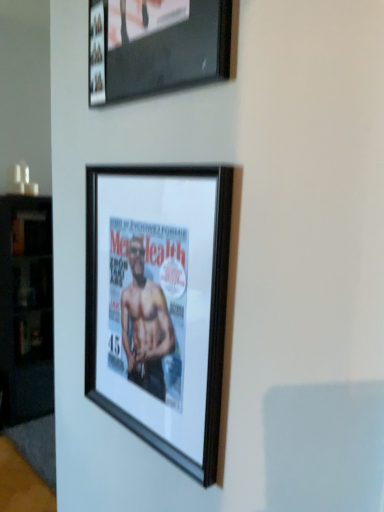
Question: From the image's perspective, relative to black matte picture frame at center, which appears as the first picture frame when ordered from the bottom, is black wood cabinet at left above or below?

Choices:
 (A) above
 (B) below

Answer: (B)

Question: Is black wood cabinet at left in front of or behind black matte picture frame at center, which appears as the first picture frame when ordered from the bottom, in the image?

Choices:
 (A) behind
 (B) front

Answer: (A)

Question: Which object is the farthest from the black matte picture frame at center, the 2th picture frame when ordered from top to bottom?

Choices:
 (A) matte black picture frame at upper center, the second picture frame when ordered from bottom to top
 (B) black wood cabinet at left

Answer: (B)

Question: Which of these objects is positioned farthest from the black wood cabinet at left?

Choices:
 (A) black matte picture frame at center, which appears as the first picture frame when ordered from the bottom
 (B) matte black picture frame at upper center, which appears as the first picture frame when viewed from the top

Answer: (B)